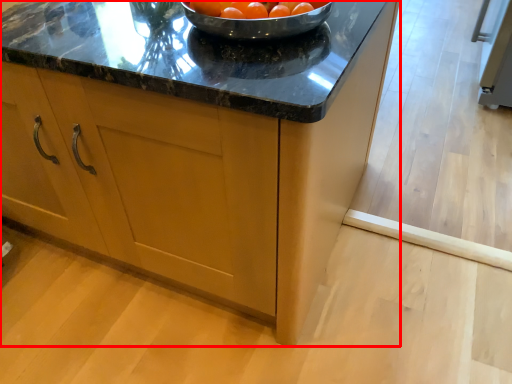
Question: From the image's perspective, where is cabinetry (annotated by the red box) located relative to tomato?

Choices:
 (A) below
 (B) above

Answer: (A)